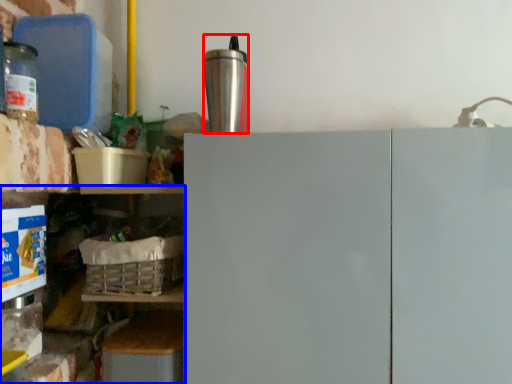
Question: Which object appears farthest to the camera in this image, appliance (highlighted by a red box) or shelf (highlighted by a blue box)?

Choices:
 (A) appliance
 (B) shelf

Answer: (B)